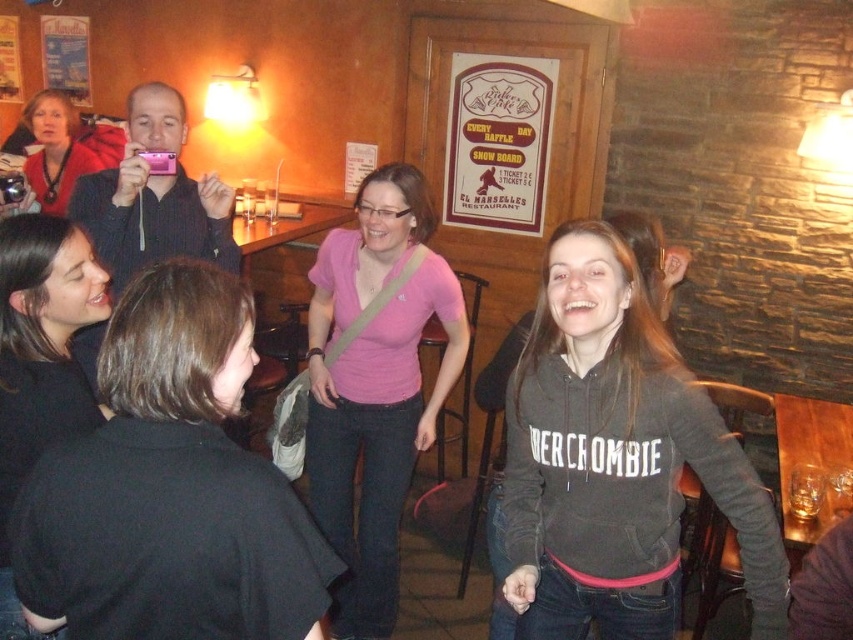
Question: Is black matte shirt at center behind pink matte t-shirt at center?

Choices:
 (A) yes
 (B) no

Answer: (B)

Question: Which object is closer to the camera taking this photo?

Choices:
 (A) black matte jacket at lower left
 (B) black hoodie at center
 (C) pink matte t-shirt at center
 (D) matte black camera at upper left

Answer: (A)

Question: Considering the real-world distances, which object is closest to the matte black camera at upper left?

Choices:
 (A) pink matte t-shirt at center
 (B) black matte jacket at lower left

Answer: (A)

Question: Is black matte shirt at center to the right of black hoodie at center from the viewer's perspective?

Choices:
 (A) yes
 (B) no

Answer: (B)

Question: Among these points, which one is nearest to the camera?

Choices:
 (A) (323, 442)
 (B) (129, 227)
 (C) (126, 406)

Answer: (C)

Question: Is pink matte t-shirt at center above black matte jacket at lower left?

Choices:
 (A) yes
 (B) no

Answer: (B)